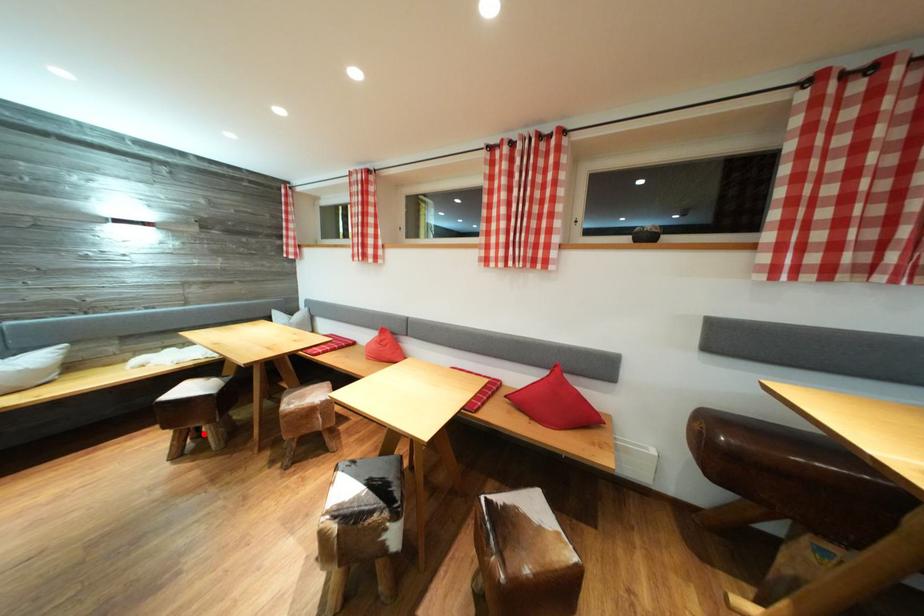
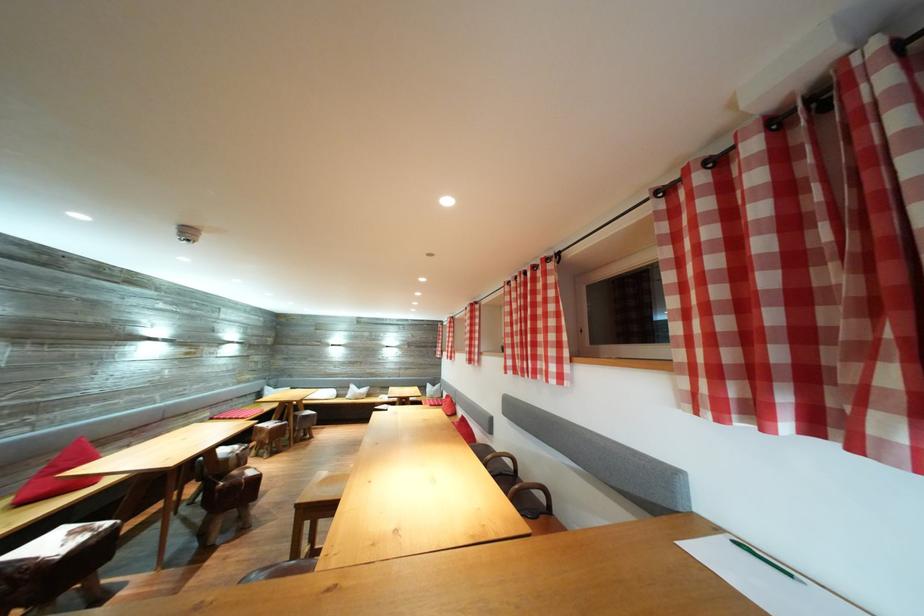
Question: I am providing you with two images of the same scene from different viewpoints. A red point is marked on the first image. At the location where the point appears in image 1, is it still visible in image 2?

Choices:
 (A) Yes
 (B) No

Answer: (B)